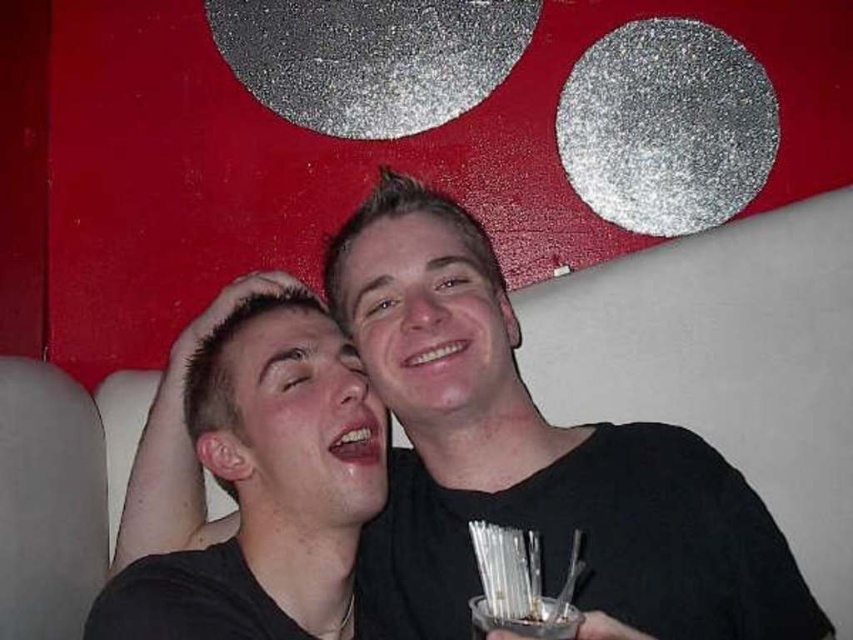
Question: From the image, what is the correct spatial relationship of black matte shirt at center in relation to clear plastic cup at lower center?

Choices:
 (A) left
 (B) right

Answer: (A)

Question: Does black matte shirt at center have a lesser width compared to smooth skin face at center?

Choices:
 (A) no
 (B) yes

Answer: (A)

Question: Considering the relative positions of black matte shirt at center and smooth skin face at center in the image provided, where is black matte shirt at center located with respect to smooth skin face at center?

Choices:
 (A) left
 (B) right

Answer: (B)

Question: Based on their relative distances, which object is nearer to the clear plastic cup at lower center?

Choices:
 (A) black matte shirt at center
 (B) smooth skin face at center

Answer: (A)

Question: Which point is closer to the camera?

Choices:
 (A) (265, 493)
 (B) (515, 627)
 (C) (189, 467)

Answer: (B)

Question: Which object is farther from the camera taking this photo?

Choices:
 (A) clear plastic cup at lower center
 (B) black matte shirt at center
 (C) smooth skin face at center

Answer: (B)